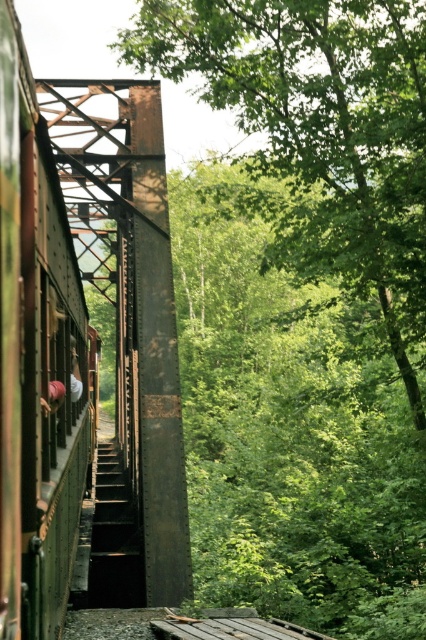
You are a maintenance worker on a train platform. You need to inspect both the rusty metal train bridge at center and the rusty metal stairs at center. According to the scene, which object is located to the left of the other?

The rusty metal train bridge at center is positioned on the left side of the rusty metal stairs at center, so the bridge is to the left of the stairs.

You are standing on the train platform and want to jump to the other side of the metal structure. The point you want to jump to is located at point (244,13). Given that the maximum distance you can jump is 12 meters, will you be able to reach it?

The distance between you and the point (244,13) is 12.94 meters, which exceeds your maximum jumping distance of 12 meters. Therefore, you will not be able to reach it.

From the picture: You are a passenger on the train and looking out the window. You see a green leafy tree at center and a rusty metal train bridge at center. Which object is taller?

The green leafy tree at center is taller than the rusty metal train bridge at center.